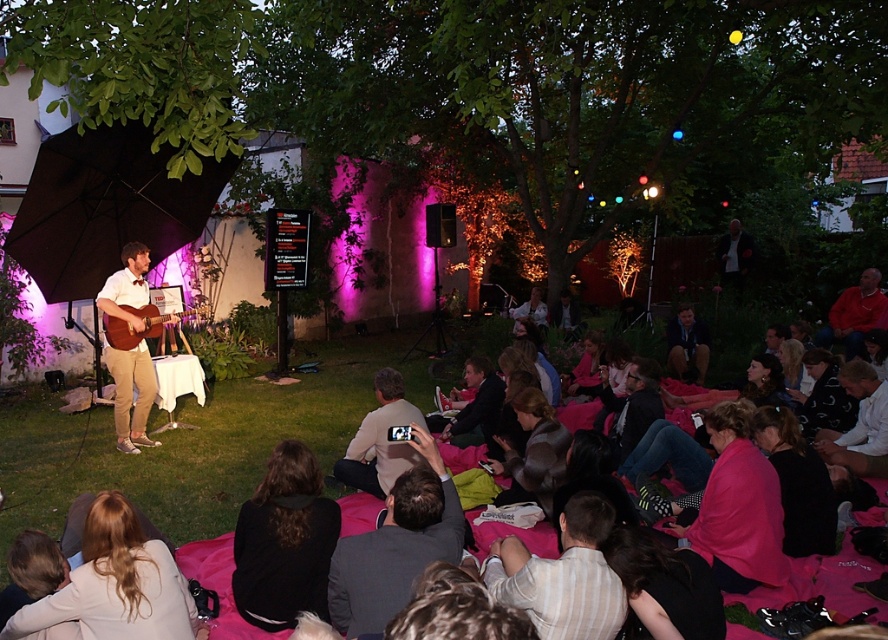
Is point (408, 412) closer to viewer compared to point (743, 275)?

Yes, it is.

What do you see at coordinates (379, 440) in the screenshot?
I see `light brown leather jacket at center` at bounding box center [379, 440].

At what (x,y) coordinates should I click in order to perform the action: click on light brown leather jacket at center. Please return your answer as a coordinate pair (x, y). This screenshot has height=640, width=888. Looking at the image, I should click on (379, 440).

In order to click on light brown leather jacket at center in this screenshot , I will do `click(379, 440)`.

Between point (131, 248) and point (846, 298), which one is positioned in front?

Point (131, 248) is more forward.

Who is shorter, matte brown guitar at left or red cotton shirt at lower right?

red cotton shirt at lower right

Is point (137, 392) positioned in front of point (844, 328)?

Yes.

Image resolution: width=888 pixels, height=640 pixels. What are the coordinates of `matte brown guitar at left` in the screenshot? It's located at (131, 394).

Does brown matte umbrella at left have a greater height compared to white shirt at lower right?

Correct, brown matte umbrella at left is much taller as white shirt at lower right.

Does brown matte umbrella at left have a larger size compared to white shirt at lower right?

Yes, brown matte umbrella at left is bigger than white shirt at lower right.

The image size is (888, 640). Describe the element at coordinates (106, 205) in the screenshot. I see `brown matte umbrella at left` at that location.

Locate an element on the screen. The width and height of the screenshot is (888, 640). brown matte umbrella at left is located at coordinates (106, 205).